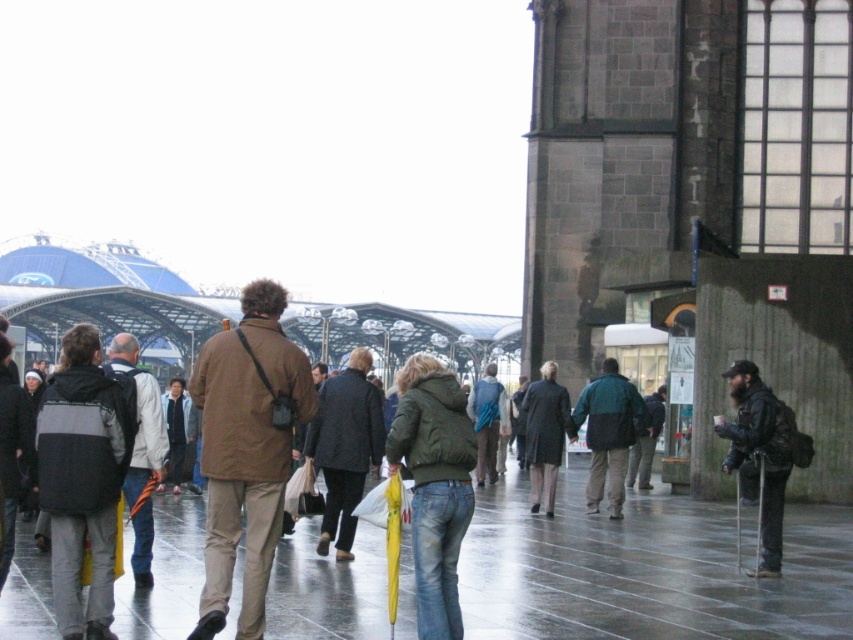
Question: Is glossy concrete pavement at center to the right of dark gray leather jacket at lower right from the viewer's perspective?

Choices:
 (A) yes
 (B) no

Answer: (B)

Question: Which is farther from the dark gray jacket at center?

Choices:
 (A) light brown leather jacket at center
 (B) dark green jacket at center
 (C) blue fabric backpack at center

Answer: (B)

Question: Is black matte jacket at left closer to the viewer compared to green matte jacket at center?

Choices:
 (A) yes
 (B) no

Answer: (A)

Question: Which object is the closest to the glossy concrete pavement at center?

Choices:
 (A) dark green jacket at center
 (B) dark gray leather jacket at lower right
 (C) dark gray coat at center

Answer: (B)

Question: In this image, where is dark gray coat at center located relative to blue fabric backpack at center?

Choices:
 (A) above
 (B) below

Answer: (A)

Question: Which object is the closest to the green matte jacket at center?

Choices:
 (A) dark gray leather jacket at lower right
 (B) brown matte jacket at center
 (C) blue fabric backpack at center
 (D) dark green jacket at center

Answer: (B)